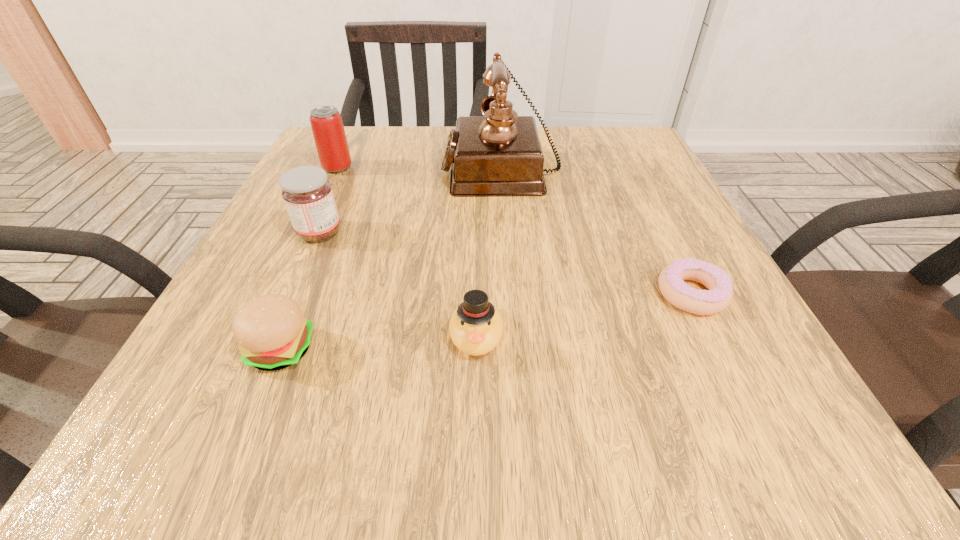
This screenshot has height=540, width=960. Find the location of `free space located 0.160m on the front of the beer can`. free space located 0.160m on the front of the beer can is located at coordinates (313, 220).

At what (x,y) coordinates should I click in order to perform the action: click on vacant space located 0.210m on the right of the fourth nearest object. Please return your answer as a coordinate pair (x, y). Looking at the image, I should click on (461, 233).

Identify the location of vacant space located 0.060m on the front-facing side of the duck. The image size is (960, 540). (475, 409).

Where is `free space located on the back of the hamburger`? This screenshot has width=960, height=540. free space located on the back of the hamburger is located at coordinates (336, 214).

Find the location of `free space located 0.180m on the left of the doughnut`. free space located 0.180m on the left of the doughnut is located at coordinates (539, 294).

I want to click on telephone present at the far edge, so click(x=499, y=154).

Locate an element on the screen. The image size is (960, 540). beer can located in the far edge section of the desktop is located at coordinates (327, 126).

This screenshot has height=540, width=960. I want to click on beer can that is positioned at the left edge, so tap(327, 126).

This screenshot has height=540, width=960. Identify the location of jam present at the left edge. tap(308, 196).

You are a GUI agent. You are given a task and a screenshot of the screen. Output one action in this format:
    pyautogui.click(x=<x>, y=<y>)
    Task: Click on the hamburger present at the left edge
    This screenshot has width=960, height=540.
    Given the screenshot: What is the action you would take?
    (272, 334)